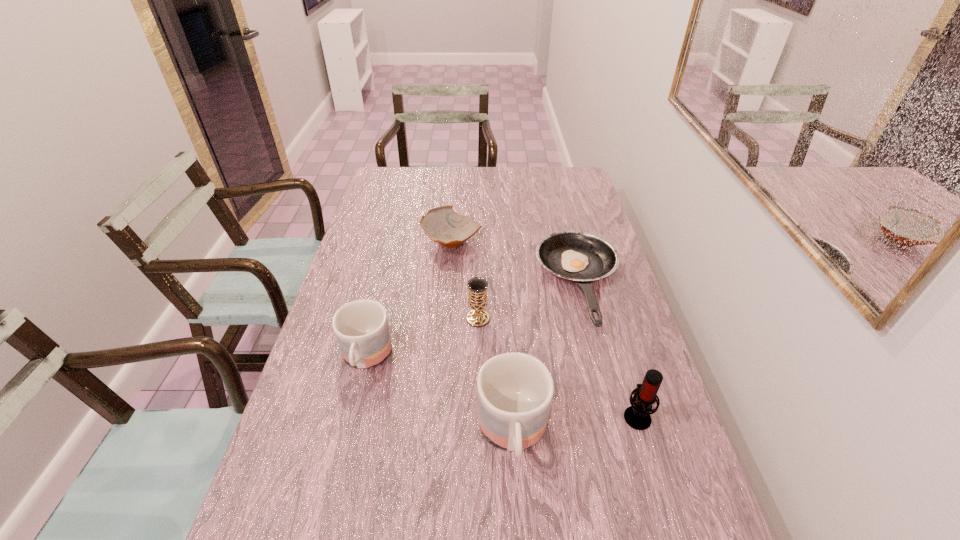
At what (x,y) coordinates should I click in order to perform the action: click on free region at the far left corner of the desktop. Please return your answer as a coordinate pair (x, y). Image resolution: width=960 pixels, height=540 pixels. Looking at the image, I should click on (391, 190).

Where is `free space at the far right corner of the desktop`? The height and width of the screenshot is (540, 960). free space at the far right corner of the desktop is located at coordinates (551, 172).

This screenshot has width=960, height=540. Identify the location of vacant area between the shortest object and the pottery. (516, 262).

The width and height of the screenshot is (960, 540). In order to click on free space between the fifth tallest object and the microphone in this screenshot , I will do `click(544, 329)`.

The height and width of the screenshot is (540, 960). I want to click on free space between the chalice and the frying pan, so click(x=529, y=301).

Image resolution: width=960 pixels, height=540 pixels. Find the location of `unoccupied area between the microphone and the nearer mug`. unoccupied area between the microphone and the nearer mug is located at coordinates (575, 424).

Identify the location of empty space that is in between the nearer mug and the frying pan. (546, 359).

Where is `empty space between the chalice and the microphone`? empty space between the chalice and the microphone is located at coordinates (558, 367).

The height and width of the screenshot is (540, 960). I want to click on vacant area that lies between the chalice and the fifth tallest object, so click(465, 280).

Where is `empty location between the right mug and the microphone`? empty location between the right mug and the microphone is located at coordinates (575, 424).